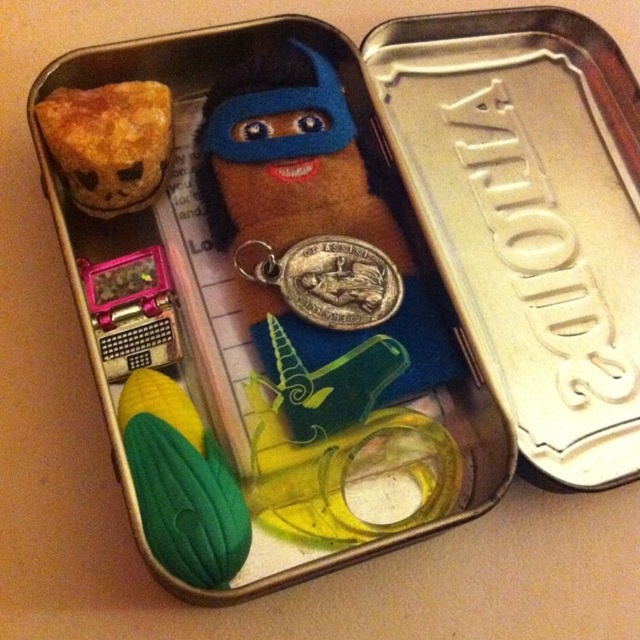
Question: Does green rubber corn at lower left appear on the right side of baked golden-brown cake at upper left?

Choices:
 (A) yes
 (B) no

Answer: (A)

Question: Among these points, which one is nearest to the camera?

Choices:
 (A) (186, 516)
 (B) (108, 179)

Answer: (A)

Question: Is green rubber corn at lower left bigger than baked golden-brown cake at upper left?

Choices:
 (A) yes
 (B) no

Answer: (A)

Question: Is green rubber corn at lower left below baked golden-brown cake at upper left?

Choices:
 (A) yes
 (B) no

Answer: (A)